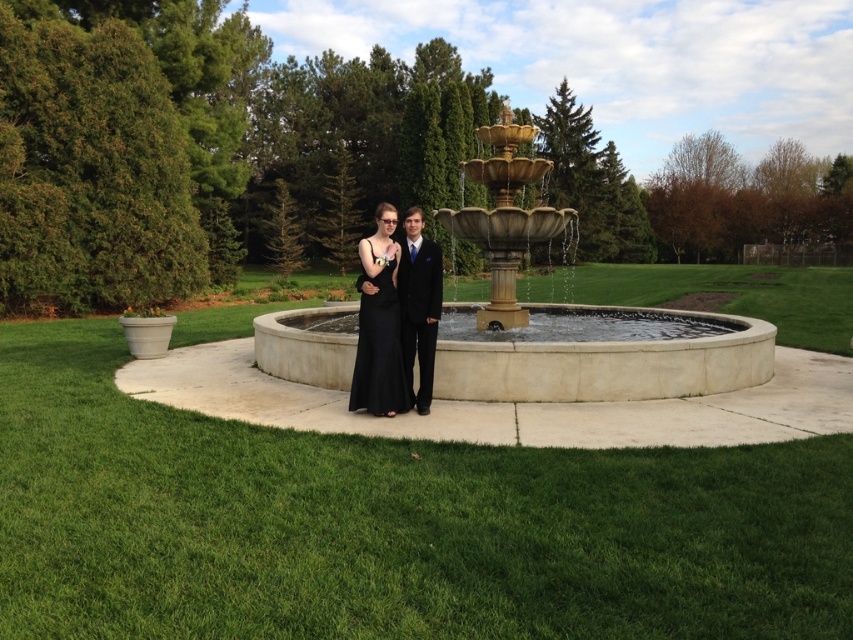
You are standing in the formal outdoor setting described. You need to place a small decorative item exactly at the point with coordinates point [576,316]. Where should you place it?

The point [576,316] is located on the gold polished stone fountain at center, so you should place the small decorative item on the gold polished stone fountain at center.

You are a photographer setting up for a formal event. You need to ensure that the gold polished stone fountain at center and the black satin dress at center are both visible in the photo. Given their sizes, which object will occupy more space in the frame?

The gold polished stone fountain at center has a larger size compared to the black satin dress at center, so it will occupy more space in the frame.

You are a photographer holding a camera. You want to take a photo of the gold polished stone fountain at center from a distance that allows you to capture the entire fountain in the frame. The camera has a maximum zoom range of 5 meters. Can you capture the entire fountain without moving closer?

The gold polished stone fountain at center and camera are 6.66 meters apart. Since the camera has a maximum zoom range of 5 meters, you cannot capture the entire fountain without moving closer as the distance exceeds the zoom capability.